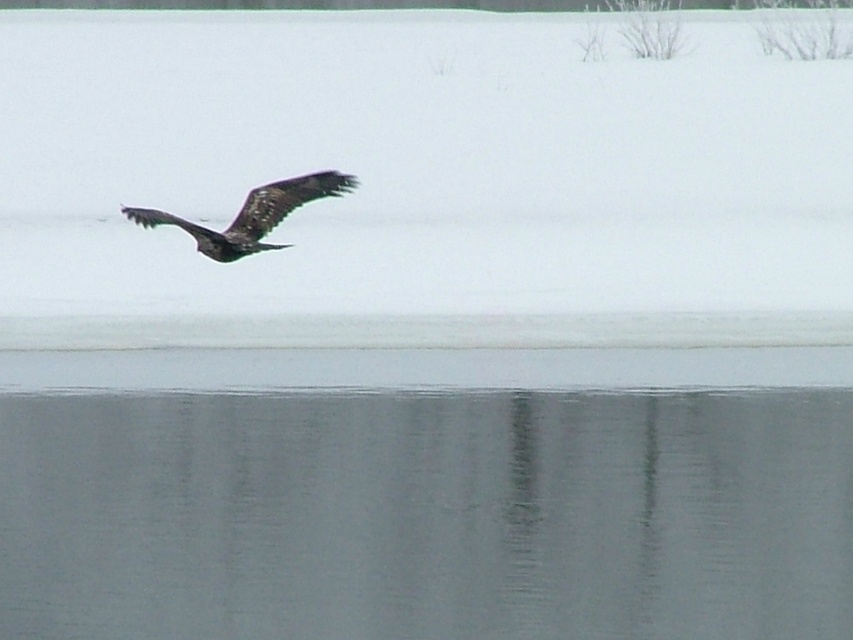
Question: Which object appears farthest from the camera in this image?

Choices:
 (A) white fluffy snow at upper center
 (B) dark brown feathers at center
 (C) smooth gray water at lower center

Answer: (C)

Question: Is white fluffy snow at upper center bigger than dark brown feathers at center?

Choices:
 (A) yes
 (B) no

Answer: (A)

Question: Is white fluffy snow at upper center thinner than dark brown feathers at center?

Choices:
 (A) no
 (B) yes

Answer: (A)

Question: Which of the following is the closest to the observer?

Choices:
 (A) (520, 561)
 (B) (172, 220)
 (C) (790, 160)

Answer: (B)

Question: Which point appears closest to the camera in this image?

Choices:
 (A) (737, 336)
 (B) (200, 250)

Answer: (B)

Question: Can you confirm if white fluffy snow at upper center is wider than dark brown feathers at center?

Choices:
 (A) yes
 (B) no

Answer: (A)